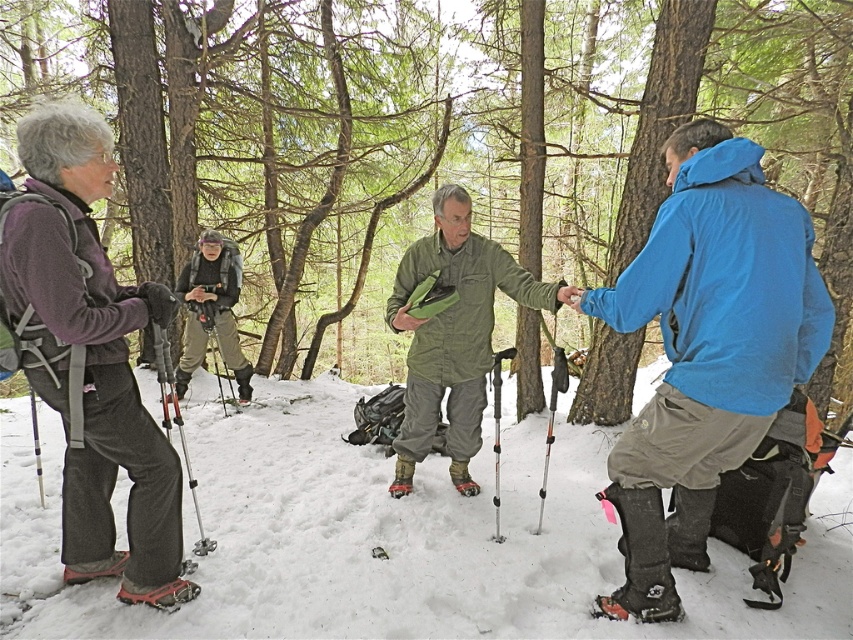
Question: Is rough bark tree at center positioned in front of brushed metal backpack at center?

Choices:
 (A) no
 (B) yes

Answer: (B)

Question: Can you confirm if brushed metal backpack at center is bigger than black plastic ski pole at center?

Choices:
 (A) no
 (B) yes

Answer: (B)

Question: Which point is closer to the camera taking this photo?

Choices:
 (A) (163, 536)
 (B) (190, 312)
 (C) (498, 413)

Answer: (A)

Question: Which of the following is the farthest from the observer?

Choices:
 (A) (318, 625)
 (B) (494, 524)

Answer: (B)

Question: Does white fluffy snow at center appear under matte purple jacket at left?

Choices:
 (A) yes
 (B) no

Answer: (A)

Question: Which object appears closest to the camera in this image?

Choices:
 (A) white fluffy snow at center
 (B) rough bark tree at center
 (C) black plastic ski pole at center

Answer: (B)